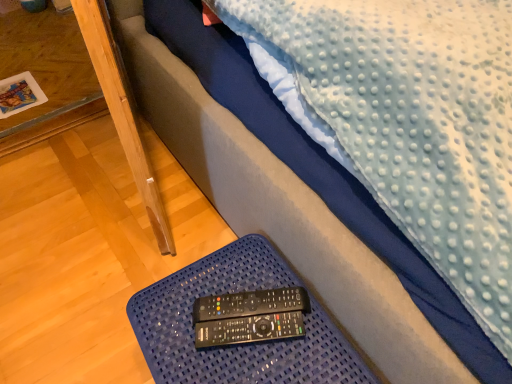
What do you see at coordinates (251, 304) in the screenshot? The height and width of the screenshot is (384, 512). I see `black plastic remote at lower center, which is counted as the second control, starting from the front` at bounding box center [251, 304].

Where is `black plastic remote at lower center, the 1th control viewed from the front`? Image resolution: width=512 pixels, height=384 pixels. black plastic remote at lower center, the 1th control viewed from the front is located at coordinates (249, 329).

In the scene shown: Are blue textured tray at lower center and black plastic remote at lower center, the 1th control viewed from the front, beside each other?

Yes, blue textured tray at lower center is in contact with black plastic remote at lower center, the 1th control viewed from the front.

Can you confirm if blue textured tray at lower center is smaller than black plastic remote at lower center, the 1th control viewed from the front?

Incorrect, blue textured tray at lower center is not smaller in size than black plastic remote at lower center, the 1th control viewed from the front.

Between blue textured tray at lower center and black plastic remote at lower center, the 1th control viewed from the front, which one is positioned behind?

black plastic remote at lower center, the 1th control viewed from the front.

From a real-world perspective, is black plastic remote at lower center, the 1th control viewed from the front, located higher than blue textured tray at lower center?

Yes, from a real-world perspective, black plastic remote at lower center, the 1th control viewed from the front, is on top of blue textured tray at lower center.

How different are the orientations of black plastic remote at lower center, the 2th control when ordered from back to front, and blue textured tray at lower center in degrees?

There is a 28.1-degree angle between the facing directions of black plastic remote at lower center, the 2th control when ordered from back to front, and blue textured tray at lower center.

Looking at this image, does black plastic remote at lower center, the 2th control when ordered from back to front, turn towards blue textured tray at lower center?

No, black plastic remote at lower center, the 2th control when ordered from back to front, is not facing towards blue textured tray at lower center.

From the picture: Is black plastic remote at lower center, the 2th control when ordered from back to front, not inside blue textured tray at lower center?

Yes, black plastic remote at lower center, the 2th control when ordered from back to front, is outside of blue textured tray at lower center.

Based on the photo, which is more to the right, black plastic remote at lower center, the 1th control viewed from the front, or black plastic remote at lower center, which is counted as the second control, starting from the front?

black plastic remote at lower center, the 1th control viewed from the front.

Is black plastic remote at lower center, the 2th control when ordered from back to front, oriented towards black plastic remote at lower center, which ranks as the 1th control in back-to-front order?

No, black plastic remote at lower center, the 2th control when ordered from back to front, does not turn towards black plastic remote at lower center, which ranks as the 1th control in back-to-front order.

Locate an element on the screen. control lying in front of the black plastic remote at lower center, which is counted as the second control, starting from the front is located at coordinates (249, 329).

Does point (309, 306) lie in front of point (183, 375)?

No, it is behind (183, 375).

From their relative heights in the image, would you say black plastic remote at lower center, which ranks as the 1th control in back-to-front order, is taller or shorter than blue textured tray at lower center?

In the image, black plastic remote at lower center, which ranks as the 1th control in back-to-front order, appears to be shorter than blue textured tray at lower center.

From a real-world perspective, is black plastic remote at lower center, which is counted as the second control, starting from the front, positioned above or below blue textured tray at lower center?

In terms of real-world spatial position, black plastic remote at lower center, which is counted as the second control, starting from the front, is above blue textured tray at lower center.

Considering the relative sizes of black plastic remote at lower center, which is counted as the second control, starting from the front, and blue textured tray at lower center in the image provided, is black plastic remote at lower center, which is counted as the second control, starting from the front, wider than blue textured tray at lower center?

Incorrect, the width of black plastic remote at lower center, which is counted as the second control, starting from the front, does not surpass that of blue textured tray at lower center.

From a real-world perspective, is wooden table at lower left positioned under blue textured tray at lower center based on gravity?

Yes, from a real-world perspective, wooden table at lower left is under blue textured tray at lower center.

Looking at this image, in terms of height, does wooden table at lower left look taller or shorter compared to blue textured tray at lower center?

Clearly, wooden table at lower left is shorter compared to blue textured tray at lower center.

Considering the relative sizes of wooden table at lower left and blue textured tray at lower center in the image provided, is wooden table at lower left smaller than blue textured tray at lower center?

Yes, wooden table at lower left is smaller than blue textured tray at lower center.

How many degrees apart are the facing directions of wooden table at lower left and blue textured tray at lower center?

The facing directions of wooden table at lower left and blue textured tray at lower center are 90.4 degrees apart.

Considering the sizes of black plastic remote at lower center, which is counted as the second control, starting from the front, and black plastic remote at lower center, the 1th control viewed from the front, in the image, is black plastic remote at lower center, which is counted as the second control, starting from the front, taller or shorter than black plastic remote at lower center, the 1th control viewed from the front,?

Considering their sizes, black plastic remote at lower center, which is counted as the second control, starting from the front, has less height than black plastic remote at lower center, the 1th control viewed from the front.

Can you see black plastic remote at lower center, which is counted as the second control, starting from the front, touching black plastic remote at lower center, the 1th control viewed from the front?

Yes, black plastic remote at lower center, which is counted as the second control, starting from the front, is with black plastic remote at lower center, the 1th control viewed from the front.

Considering their positions, is black plastic remote at lower center, which ranks as the 1th control in back-to-front order, located in front of or behind black plastic remote at lower center, the 1th control viewed from the front?

black plastic remote at lower center, which ranks as the 1th control in back-to-front order, is behind black plastic remote at lower center, the 1th control viewed from the front.

Considering the relative positions of black plastic remote at lower center, which is counted as the second control, starting from the front, and black plastic remote at lower center, the 2th control when ordered from back to front, in the image provided, is black plastic remote at lower center, which is counted as the second control, starting from the front, to the left or to the right of black plastic remote at lower center, the 2th control when ordered from back to front,?

black plastic remote at lower center, which is counted as the second control, starting from the front, is to the left of black plastic remote at lower center, the 2th control when ordered from back to front.

Is blue textured tray at lower center smaller than wooden table at lower left?

No, blue textured tray at lower center is not smaller than wooden table at lower left.

From a real-world perspective, is blue textured tray at lower center physically above wooden table at lower left?

Yes, from a real-world perspective, blue textured tray at lower center is on top of wooden table at lower left.

Locate an element on the screen. The height and width of the screenshot is (384, 512). furniture that is below the wooden table at lower left (from the image's perspective) is located at coordinates (x=234, y=347).

Considering the sizes of blue textured tray at lower center and wooden table at lower left in the image, is blue textured tray at lower center taller or shorter than wooden table at lower left?

In the image, blue textured tray at lower center appears to be taller than wooden table at lower left.

I want to click on furniture on the left of black plastic remote at lower center, the 2th control when ordered from back to front, so click(x=234, y=347).

Where is `the 1st control positioned above the blue textured tray at lower center (from a real-world perspective)`? the 1st control positioned above the blue textured tray at lower center (from a real-world perspective) is located at coordinates (249, 329).

Which object lies further to the anchor point black plastic remote at lower center, the 1th control viewed from the front, black plastic remote at lower center, which ranks as the 1th control in back-to-front order, or blue textured tray at lower center?

blue textured tray at lower center lies further to black plastic remote at lower center, the 1th control viewed from the front, than the other object.

When comparing their distances from blue textured tray at lower center, does wooden table at lower left or black plastic remote at lower center, the 1th control viewed from the front, seem further?

wooden table at lower left is further to blue textured tray at lower center.

Considering their positions, is black plastic remote at lower center, the 1th control viewed from the front, positioned further to black plastic remote at lower center, which is counted as the second control, starting from the front, than blue textured tray at lower center?

blue textured tray at lower center is further to black plastic remote at lower center, which is counted as the second control, starting from the front.

When comparing their distances from wooden table at lower left, does blue textured tray at lower center or black plastic remote at lower center, the 1th control viewed from the front, seem closer?

Based on the image, blue textured tray at lower center appears to be nearer to wooden table at lower left.

From the picture: Which object lies further to the anchor point black plastic remote at lower center, the 1th control viewed from the front, wooden table at lower left or blue textured tray at lower center?

Among the two, wooden table at lower left is located further to black plastic remote at lower center, the 1th control viewed from the front.

Which object lies nearer to the anchor point black plastic remote at lower center, the 2th control when ordered from back to front, blue textured tray at lower center or wooden table at lower left?

blue textured tray at lower center.

Considering their positions, is blue textured tray at lower center positioned further to black plastic remote at lower center, the 1th control viewed from the front, than black plastic remote at lower center, which ranks as the 1th control in back-to-front order?

Among the two, blue textured tray at lower center is located further to black plastic remote at lower center, the 1th control viewed from the front.

From the image, which object appears to be nearer to black plastic remote at lower center, which is counted as the second control, starting from the front, wooden table at lower left or black plastic remote at lower center, the 2th control when ordered from back to front?

The object closer to black plastic remote at lower center, which is counted as the second control, starting from the front, is black plastic remote at lower center, the 2th control when ordered from back to front.

I want to click on control between wooden table at lower left and black plastic remote at lower center, the 1th control viewed from the front, from left to right, so click(x=251, y=304).

Where is `furniture between wooden table at lower left and black plastic remote at lower center, the 2th control when ordered from back to front`? This screenshot has height=384, width=512. furniture between wooden table at lower left and black plastic remote at lower center, the 2th control when ordered from back to front is located at coordinates (234, 347).

Locate an element on the screen. Image resolution: width=512 pixels, height=384 pixels. control located between blue textured tray at lower center and black plastic remote at lower center, which ranks as the 1th control in back-to-front order, in the depth direction is located at coordinates (249, 329).

This screenshot has width=512, height=384. In order to click on furniture between wooden table at lower left and black plastic remote at lower center, which is counted as the second control, starting from the front in this screenshot , I will do `click(234, 347)`.